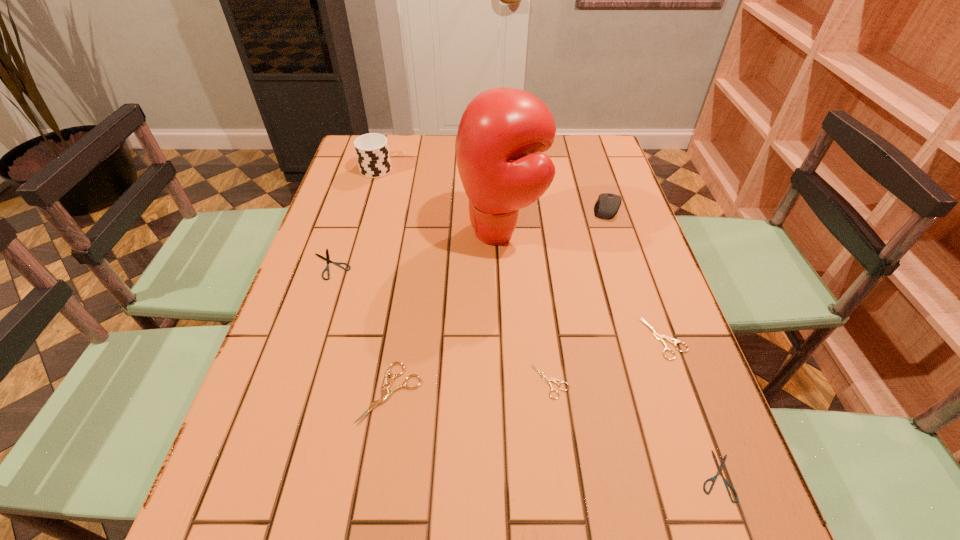
This screenshot has width=960, height=540. What are the coordinates of `shears situated at the left edge` in the screenshot? It's located at (327, 259).

Where is `computer equipment positioned at the right edge`? Image resolution: width=960 pixels, height=540 pixels. computer equipment positioned at the right edge is located at coordinates (x=608, y=204).

Where is `object that is at the far left corner`? This screenshot has width=960, height=540. object that is at the far left corner is located at coordinates (372, 151).

The image size is (960, 540). Identify the location of vacant space at the far edge of the desktop. (437, 148).

I want to click on vacant space at the left edge, so click(x=235, y=446).

The width and height of the screenshot is (960, 540). Identify the location of vacant area at the right edge. (655, 358).

The image size is (960, 540). In the image, there is a desktop. Identify the location of vacant space at the far right corner. (583, 158).

You are a GUI agent. You are given a task and a screenshot of the screen. Output one action in this format:
    pyautogui.click(x=<x>, y=<y>)
    Task: Click on the free space between the boxing glove and the biggest beige shears
    
    Given the screenshot: What is the action you would take?
    pyautogui.click(x=445, y=313)

Where is `free spot between the red boxing glove and the black computer equipment`? The height and width of the screenshot is (540, 960). free spot between the red boxing glove and the black computer equipment is located at coordinates (554, 220).

Locate an element on the screen. unoccupied position between the cup and the rightmost beige shears is located at coordinates (520, 253).